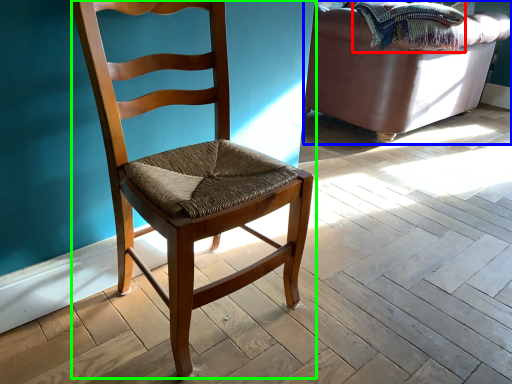
Question: Which is farther away from blanket (highlighted by a red box)? studio couch (highlighted by a blue box) or chair (highlighted by a green box)?

Choices:
 (A) studio couch
 (B) chair

Answer: (B)